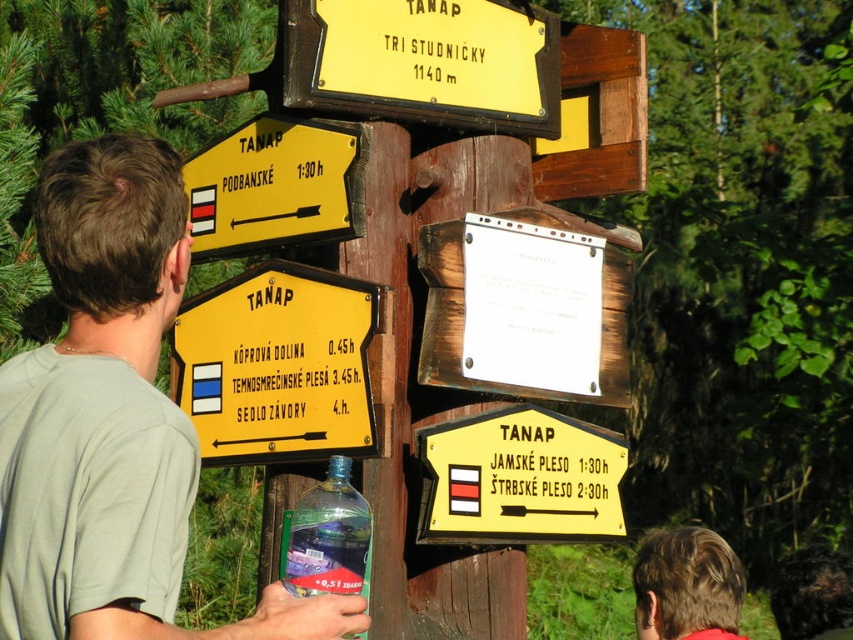
What is located at the point with coordinates (283,365) in the image?

At the point with coordinates (283,365) lies the yellow matte signpost at center.

You are standing at the wooden signpost in the forest and notice a person wearing a green cotton shirt at upper left and another person with blonde hair at upper right. If you want to meet both people, which direction should you walk to first reach the person closer to you?

The green cotton shirt at upper left and blonde hair at upper right are 22.19 feet apart. Since the distance between them is the same, you can choose either direction to reach both people first.

You are standing at the base of the yellow matte signpost at center and want to take a photo of it with your camera. If the camera can focus on objects up to 50 feet away, will you be able to capture the entire signpost in one shot without moving?

The yellow matte signpost at center and camera are 45.71 feet apart, which is within the camera focus range of up to 50 feet. Therefore, you can capture the entire signpost in one shot without moving.